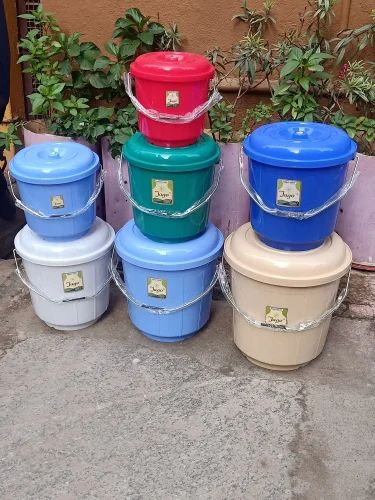
The image size is (375, 500). Find the location of `green bucket`. green bucket is located at coordinates (187, 182).